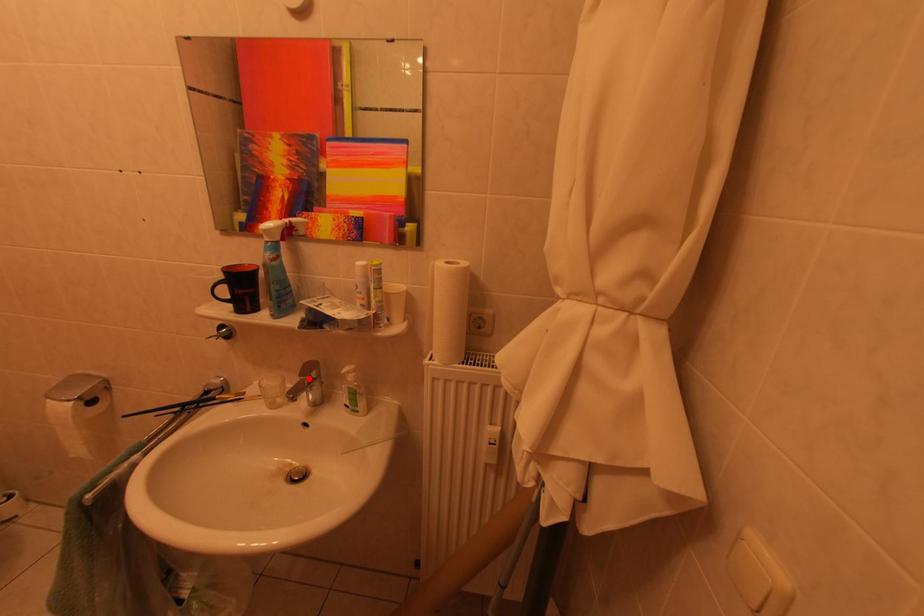
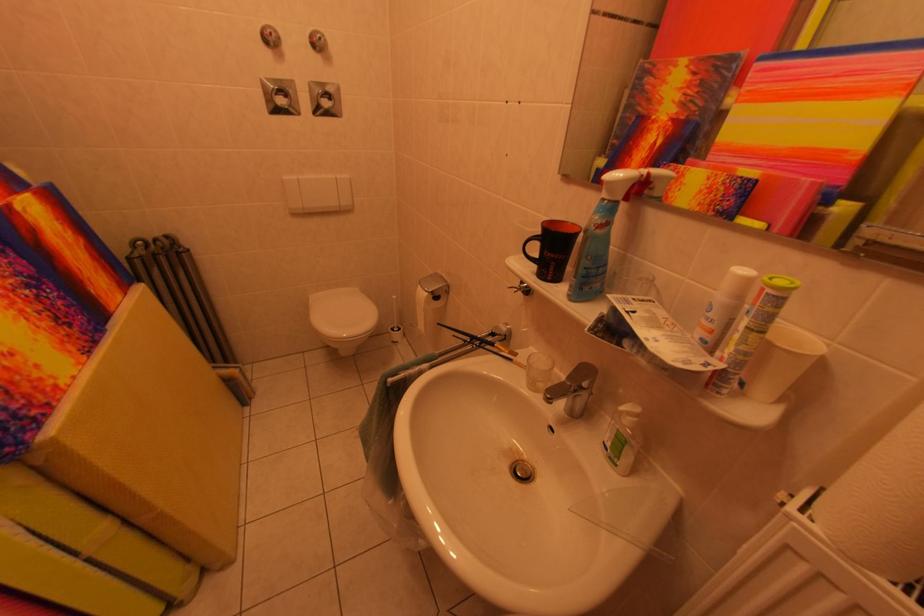
The point at the highlighted location is marked in the first image. Where is the corresponding point in the second image?

(578, 382)